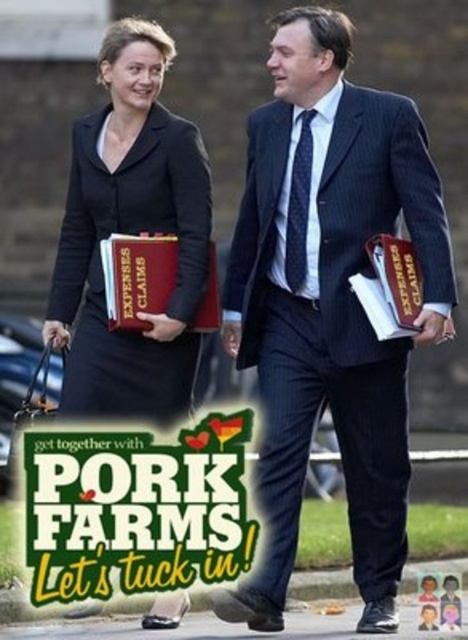
Question: Which point appears closest to the camera in this image?

Choices:
 (A) [x=269, y=204]
 (B) [x=75, y=467]

Answer: (B)

Question: Is dark blue pinstripe suit at center above black matte suit at center?

Choices:
 (A) yes
 (B) no

Answer: (A)

Question: Does black matte suit at center lie behind green paper poster at center?

Choices:
 (A) no
 (B) yes

Answer: (B)

Question: Which object is the farthest from the matte brown leather book at center?

Choices:
 (A) black matte suit at center
 (B) green paper poster at center

Answer: (B)

Question: Is dark blue pinstripe suit at center positioned at the back of green paper poster at center?

Choices:
 (A) no
 (B) yes

Answer: (B)

Question: Considering the real-world distances, which object is closest to the black matte suit at center?

Choices:
 (A) matte brown leather book at center
 (B) dark blue pinstripe suit at center

Answer: (B)